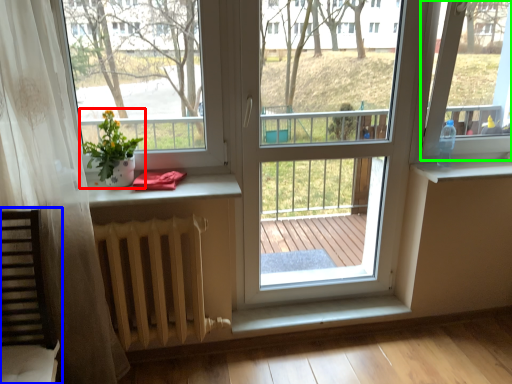
Question: Which is nearer to the houseplant (highlighted by a red box)? rocking chair (highlighted by a blue box) or window screen (highlighted by a green box).

Choices:
 (A) rocking chair
 (B) window screen

Answer: (A)